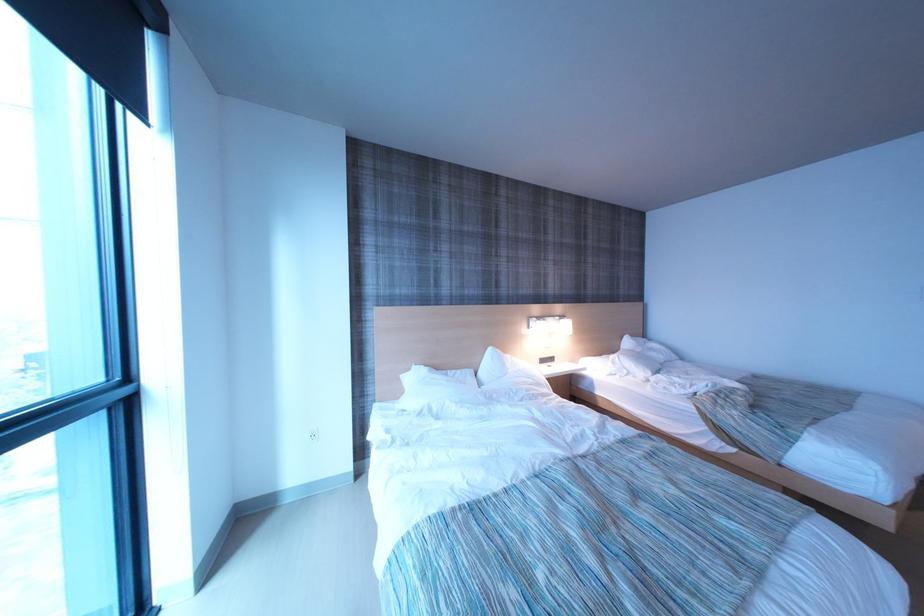
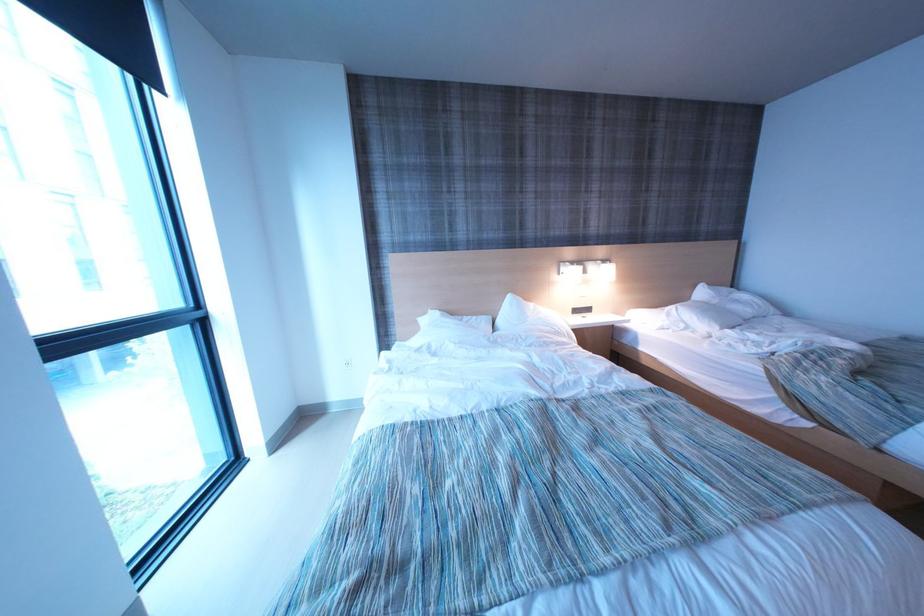
Question: Based on the continuous images, in which direction is the camera rotating? Reply with the corresponding letter.

Choices:
 (A) Left
 (B) Right
 (C) Up
 (D) Down

Answer: (A)